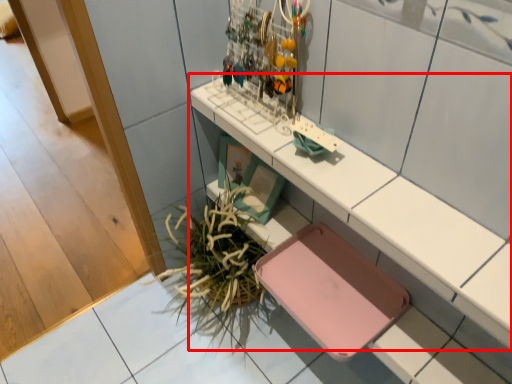
Question: In this image, where is shelf (annotated by the red box) located relative to plant?

Choices:
 (A) right
 (B) left

Answer: (A)